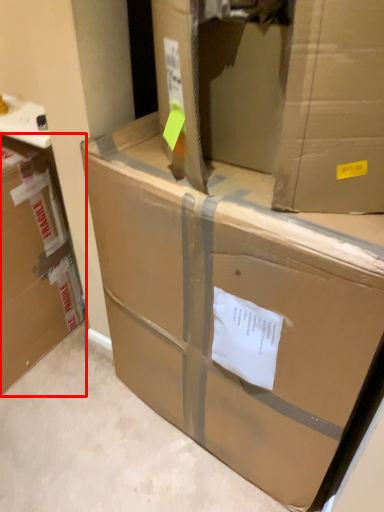
Question: Where is box (annotated by the red box) located in relation to box in the image?

Choices:
 (A) right
 (B) left

Answer: (B)